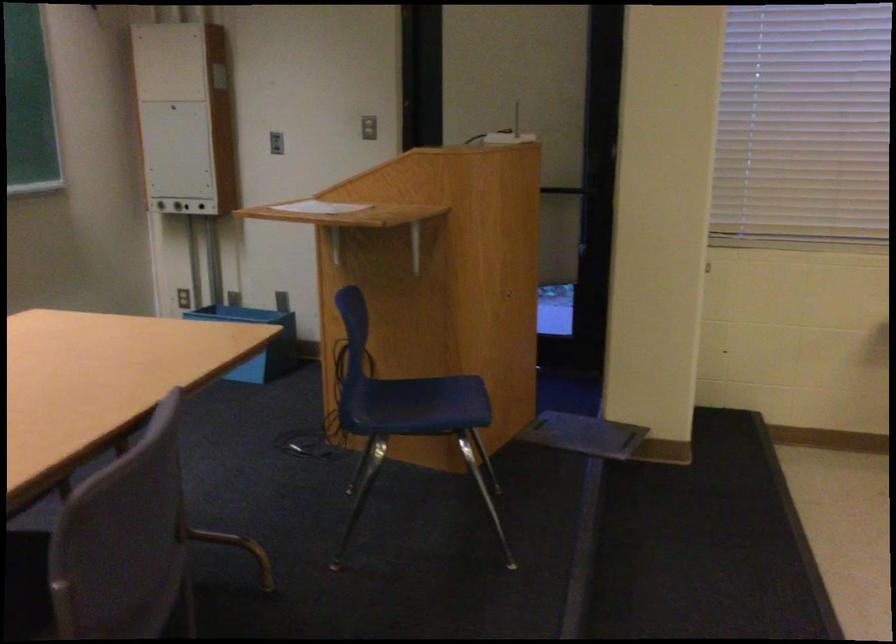
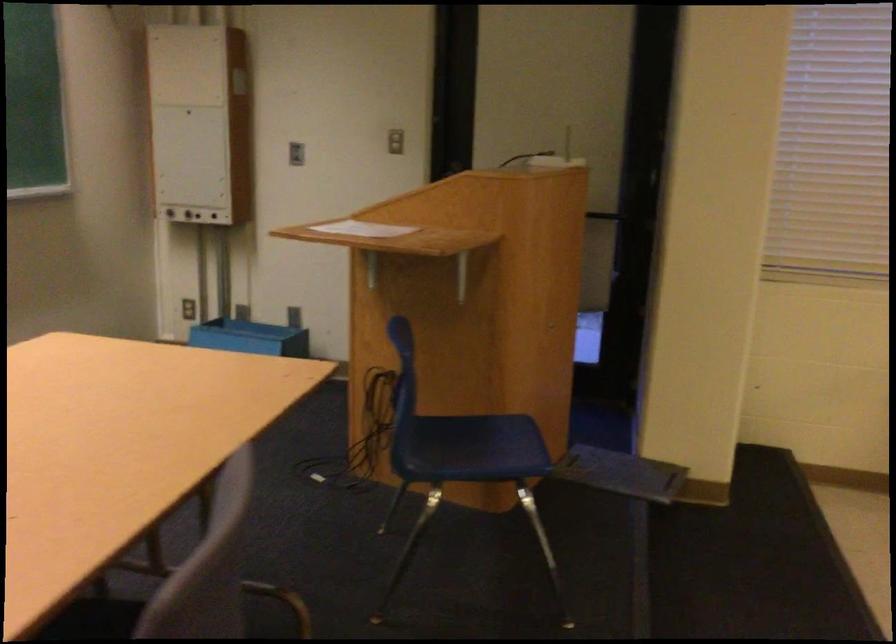
In the second image, find the point that corresponds to (417,402) in the first image.

(466, 442)